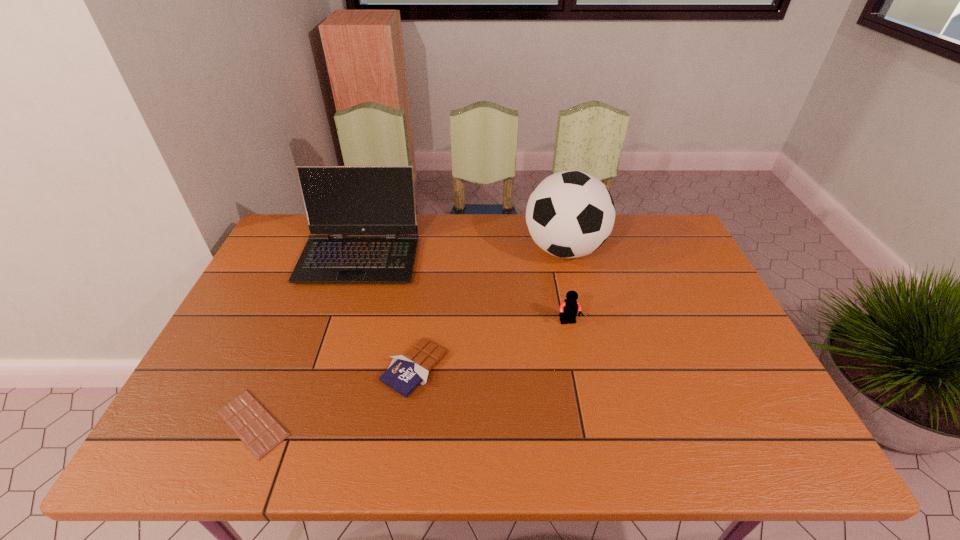
Find the location of a particular element. The image size is (960, 540). free space at the far edge of the desktop is located at coordinates (609, 243).

The image size is (960, 540). Identify the location of vacant space at the near edge. (379, 443).

This screenshot has height=540, width=960. I want to click on free region at the left edge of the desktop, so click(257, 333).

In the image, there is a desktop. At what (x,y) coordinates should I click in order to perform the action: click on vacant space at the right edge. Please return your answer as a coordinate pair (x, y). Looking at the image, I should click on (672, 305).

At what (x,y) coordinates should I click in order to perform the action: click on vacant space at the near left corner. Please return your answer as a coordinate pair (x, y). Looking at the image, I should click on (230, 451).

In the image, there is a desktop. At what (x,y) coordinates should I click in order to perform the action: click on blank space at the far right corner. Please return your answer as a coordinate pair (x, y). This screenshot has width=960, height=540. Looking at the image, I should click on (641, 216).

Identify the location of blank region between the right chocolate bar and the Lego. (492, 345).

Where is `vacant area that lies between the taller chocolate bar and the Lego`? Image resolution: width=960 pixels, height=540 pixels. vacant area that lies between the taller chocolate bar and the Lego is located at coordinates coord(492,345).

Locate an element on the screen. This screenshot has width=960, height=540. free point between the second shortest object and the soccer ball is located at coordinates (490, 309).

I want to click on vacant space in between the right chocolate bar and the shortest object, so click(x=334, y=396).